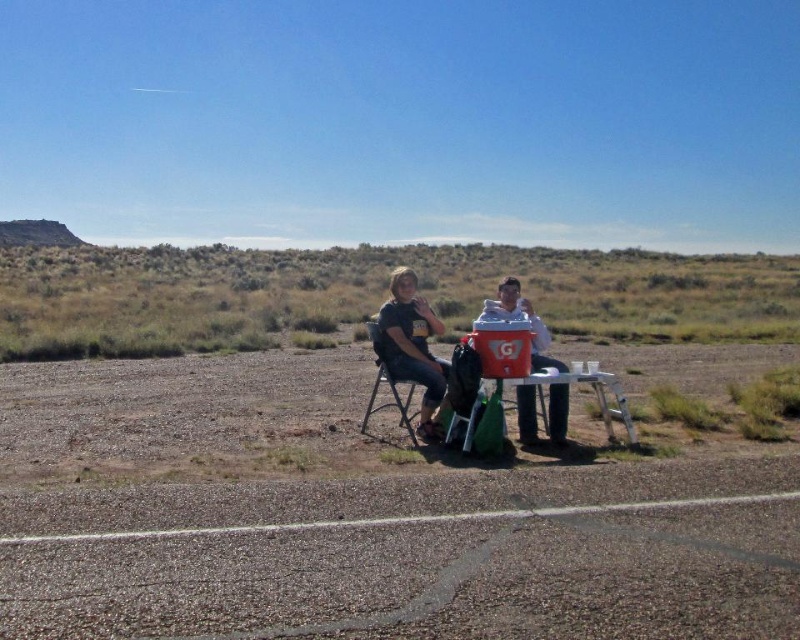
Is point (264, 420) more distant than point (505, 294)?

Yes, point (264, 420) is farther from viewer.

Consider the image. Does dirt field at center have a greater width compared to white fabric shirt at center?

Indeed, dirt field at center has a greater width compared to white fabric shirt at center.

Based on the photo, who is more distant from viewer, (244, 364) or (513, 305)?

The point (244, 364) is behind.

Locate an element on the screen. The width and height of the screenshot is (800, 640). dirt field at center is located at coordinates (366, 522).

Is point (508, 289) less distant than point (377, 410)?

Yes, it is in front of point (377, 410).

Can you confirm if white fabric shirt at center is positioned to the right of black plastic chair at center?

Correct, you'll find white fabric shirt at center to the right of black plastic chair at center.

Is point (536, 317) positioned in front of point (370, 417)?

Yes, it is.

You are a GUI agent. You are given a task and a screenshot of the screen. Output one action in this format:
    pyautogui.click(x=<x>, y=<y>)
    Task: Click on the white fabric shirt at center
    This screenshot has width=800, height=640.
    Given the screenshot: What is the action you would take?
    pyautogui.click(x=522, y=317)

What do you see at coordinates (522, 317) in the screenshot?
I see `white fabric shirt at center` at bounding box center [522, 317].

Between white fabric shirt at center and matte plastic table at center, which one is positioned higher?

matte plastic table at center

Who is more distant from viewer, (560, 412) or (564, 365)?

The point (564, 365) is more distant.

You are a GUI agent. You are given a task and a screenshot of the screen. Output one action in this format:
    pyautogui.click(x=<x>, y=<y>)
    Task: Click on the white fabric shirt at center
    
    Given the screenshot: What is the action you would take?
    pyautogui.click(x=522, y=317)